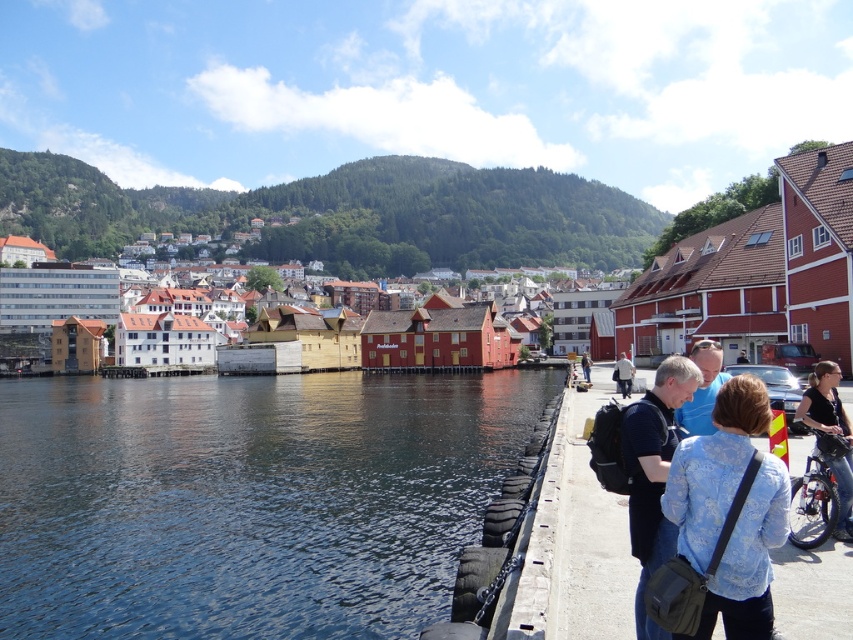
You are a photographer trying to capture a shot of the waterfront scene. You want to ensure that both the wooden dock at lower right and the white wooden buildings at center are clearly visible in your photo. Based on their heights, which object will appear larger in the frame?

The wooden dock at lower right is taller than the white wooden buildings at center, so it will appear larger in the frame.